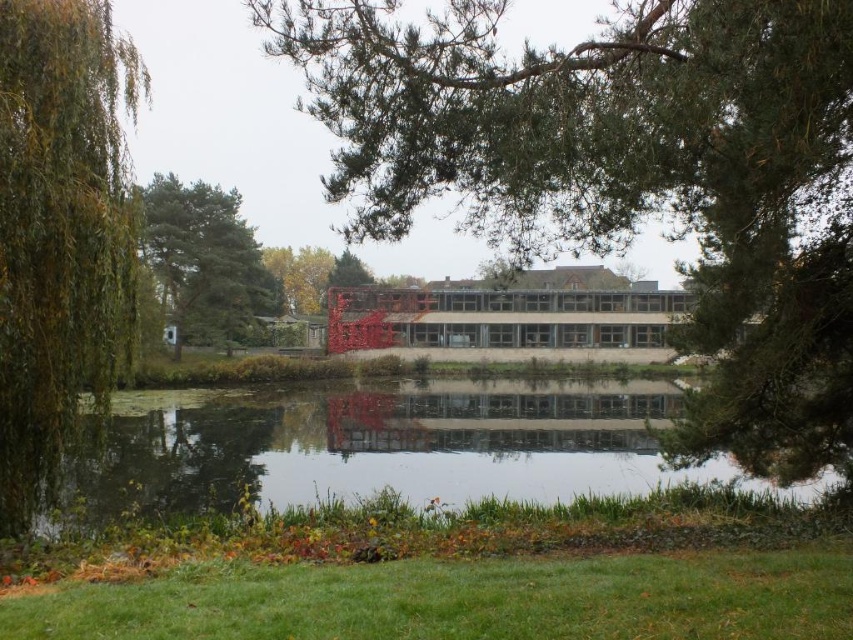
You are planning to plant a new tree in the garden. You have two options from the image, the green pine tree at center and the green leafy tree at left. Which tree has a wider canopy to provide more shade?

The green pine tree at center has a larger width than the green leafy tree at left, so it provides more shade.

You are standing in the serene outdoor scene and want to walk from the point closer to you to the point farther away. Which path would you take between point (543, 406) and point (166, 234)?

You should walk towards point (166, 234) because point (543, 406) is closer to you, so moving towards point (166, 234) would be going away from the closer point to the farther one.